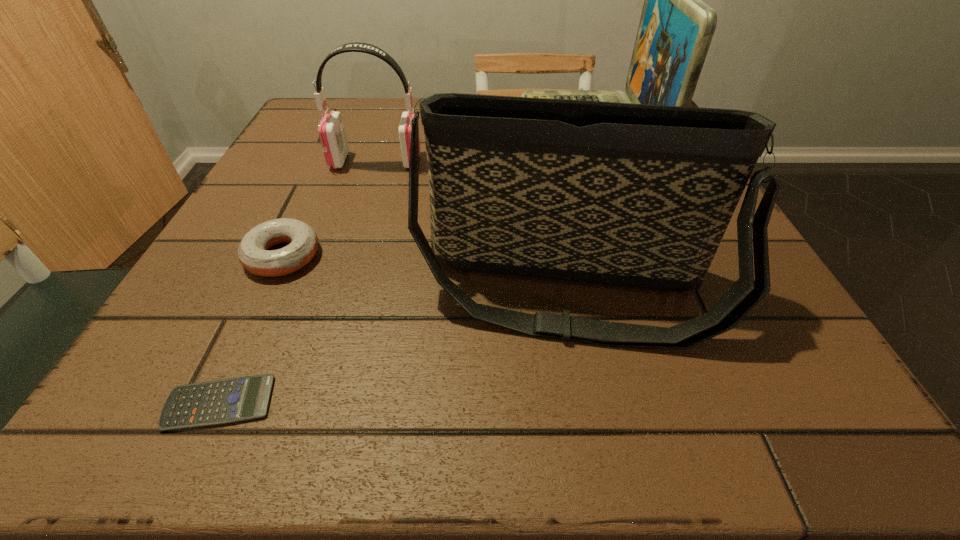
What are the coordinates of `free space between the nearest object and the laptop computer` in the screenshot? It's located at (403, 266).

Where is `free space between the doughnut and the handbag`? This screenshot has height=540, width=960. free space between the doughnut and the handbag is located at coordinates (424, 273).

The width and height of the screenshot is (960, 540). What are the coordinates of `free space between the shortest object and the earphone` in the screenshot? It's located at (298, 282).

Find the location of `vacant space that's between the doughnut and the shortest object`. vacant space that's between the doughnut and the shortest object is located at coordinates (252, 329).

I want to click on free space between the second shortest object and the earphone, so click(329, 208).

At what (x,y) coordinates should I click in order to perform the action: click on vacant space in between the fourth tallest object and the nearest object. Please return your answer as a coordinate pair (x, y). This screenshot has width=960, height=540. Looking at the image, I should click on (252, 329).

You are a GUI agent. You are given a task and a screenshot of the screen. Output one action in this format:
    pyautogui.click(x=<x>, y=<y>)
    Task: Click on the closest object to the laptop computer
    
    Given the screenshot: What is the action you would take?
    pyautogui.click(x=637, y=195)

Identify which object is the third closest to the handbag. Please provide its 2D coordinates. Your answer should be formatted as a tuple, i.e. [(x, y)], where the tuple contains the x and y coordinates of a point satisfying the conditions above.

[(331, 131)]

Identify the location of vacant space that satisfies the following two spatial constraints: 1. on the front side of the doughnut; 2. on the right side of the handbag. (267, 291).

Image resolution: width=960 pixels, height=540 pixels. Find the location of `free point that satisfies the following two spatial constraints: 1. on the front side of the fourth tallest object; 2. on the left side of the handbag`. free point that satisfies the following two spatial constraints: 1. on the front side of the fourth tallest object; 2. on the left side of the handbag is located at coordinates (267, 291).